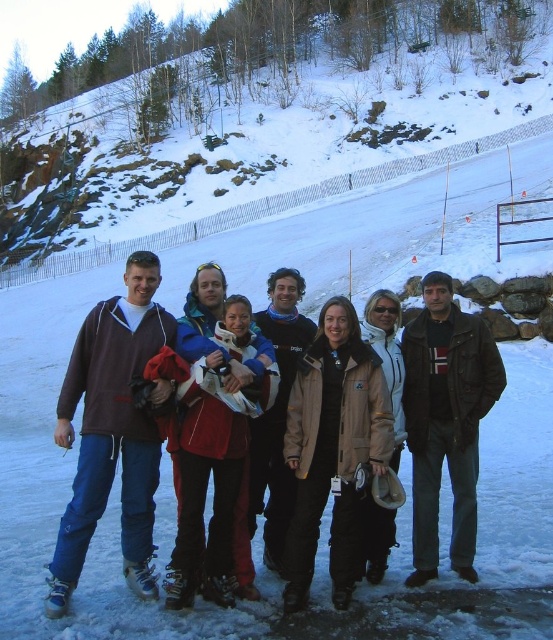
Question: Does matte blue jacket at center have a smaller size compared to dark brown leather jacket at center?

Choices:
 (A) no
 (B) yes

Answer: (A)

Question: Is matte blue jacket at center smaller than dark brown leather jacket at center?

Choices:
 (A) no
 (B) yes

Answer: (A)

Question: Is snowy rock at center bigger than blue fleece jacket at center?

Choices:
 (A) yes
 (B) no

Answer: (A)

Question: Based on their relative distances, which object is farther from the snowy rock at center?

Choices:
 (A) blue fleece jacket at center
 (B) matte blue jacket at center

Answer: (B)

Question: Estimate the real-world distances between objects in this image. Which object is farther from the matte brown jacket at left?

Choices:
 (A) blue fleece jacket at center
 (B) matte blue jacket at center
 (C) snowy rock at center

Answer: (C)

Question: Estimate the real-world distances between objects in this image. Which object is farther from the matte blue jacket at center?

Choices:
 (A) snowy rock at center
 (B) matte brown jacket at left

Answer: (A)